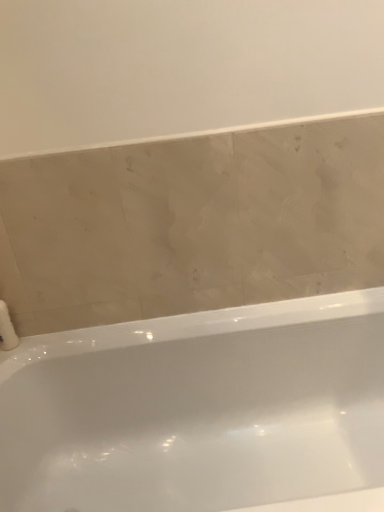
Question: Does white fluffy toilet paper at lower left come behind white glossy bathtub at center?

Choices:
 (A) yes
 (B) no

Answer: (A)

Question: Is white fluffy toilet paper at lower left to the left of white glossy bathtub at center from the viewer's perspective?

Choices:
 (A) no
 (B) yes

Answer: (B)

Question: Can you confirm if white fluffy toilet paper at lower left is positioned to the right of white glossy bathtub at center?

Choices:
 (A) no
 (B) yes

Answer: (A)

Question: From the image's perspective, is white fluffy toilet paper at lower left under white glossy bathtub at center?

Choices:
 (A) yes
 (B) no

Answer: (B)

Question: Is white fluffy toilet paper at lower left smaller than white glossy bathtub at center?

Choices:
 (A) yes
 (B) no

Answer: (A)

Question: From a real-world perspective, is white fluffy toilet paper at lower left located beneath white glossy bathtub at center?

Choices:
 (A) yes
 (B) no

Answer: (B)

Question: Can you confirm if white glossy bathtub at center is smaller than white fluffy toilet paper at lower left?

Choices:
 (A) yes
 (B) no

Answer: (B)

Question: Can we say white glossy bathtub at center lies outside white fluffy toilet paper at lower left?

Choices:
 (A) yes
 (B) no

Answer: (A)

Question: Is the position of white glossy bathtub at center less distant than that of white fluffy toilet paper at lower left?

Choices:
 (A) yes
 (B) no

Answer: (A)

Question: Is white glossy bathtub at center at the left side of white fluffy toilet paper at lower left?

Choices:
 (A) yes
 (B) no

Answer: (B)

Question: Can you confirm if white glossy bathtub at center is shorter than white fluffy toilet paper at lower left?

Choices:
 (A) yes
 (B) no

Answer: (B)

Question: Can you confirm if white glossy bathtub at center is wider than white fluffy toilet paper at lower left?

Choices:
 (A) no
 (B) yes

Answer: (B)

Question: Based on their sizes in the image, would you say white fluffy toilet paper at lower left is bigger or smaller than white glossy bathtub at center?

Choices:
 (A) big
 (B) small

Answer: (B)